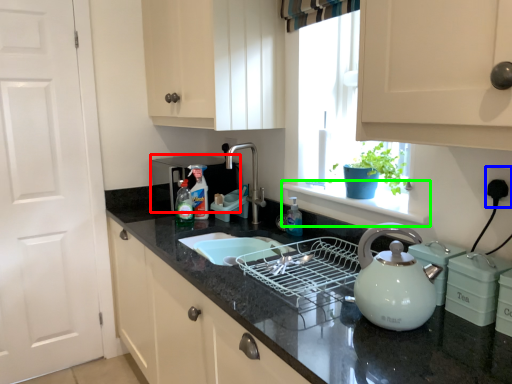
Question: Estimate the real-world distances between objects in this image. Which object is farther from appliance (highlighted by a red box), electric outlet (highlighted by a blue box) or window sill (highlighted by a green box)?

Choices:
 (A) electric outlet
 (B) window sill

Answer: (A)